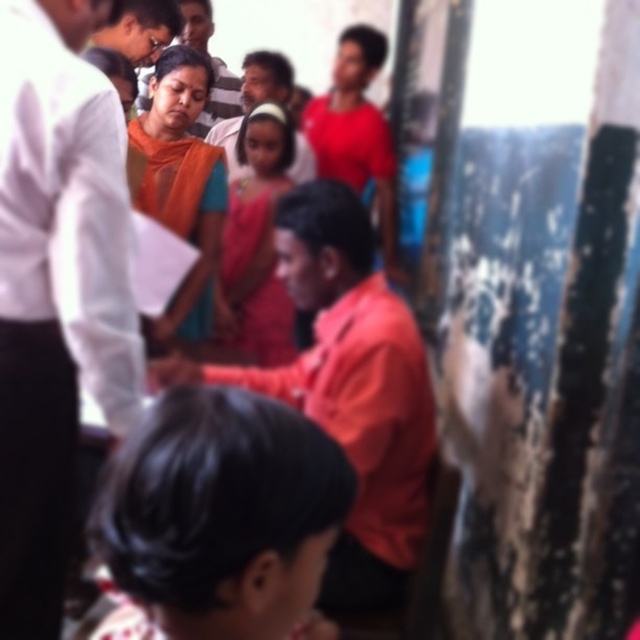
You are a photographer who wants to capture a photo of the orange matte shirt at center and the matte orange saree at upper center. Which object should you focus on first if you want to ensure both are in focus without moving the camera?

The orange matte shirt at center is located below the matte orange saree at upper center. To ensure both are in focus, you should focus on the matte orange saree at upper center first since it is farther away and requires a smaller aperture for depth of field, allowing the orange matte shirt at center to also be in focus.

You are organizing a group photo and need to arrange two people based on their shirt colors. The matte white shirt at center and the orange matte shirt at center are both in the frame. Which shirt should be placed on the left side if you want the thinner person to be on the left?

The matte white shirt at center is thinner than the orange matte shirt at center, so the person wearing the matte white shirt at center should be placed on the left side.

You are a photographer trying to capture a photo of the matte orange shirt at center and the black hair at lower center. Based on their positions, which object should you adjust your camera to focus on first to ensure both are in frame?

Since the black hair at lower center is to the right of the matte orange shirt at center, you should first focus on the matte orange shirt at center to ensure it is centered in the frame before adjusting slightly to the right to include the black hair at lower center.